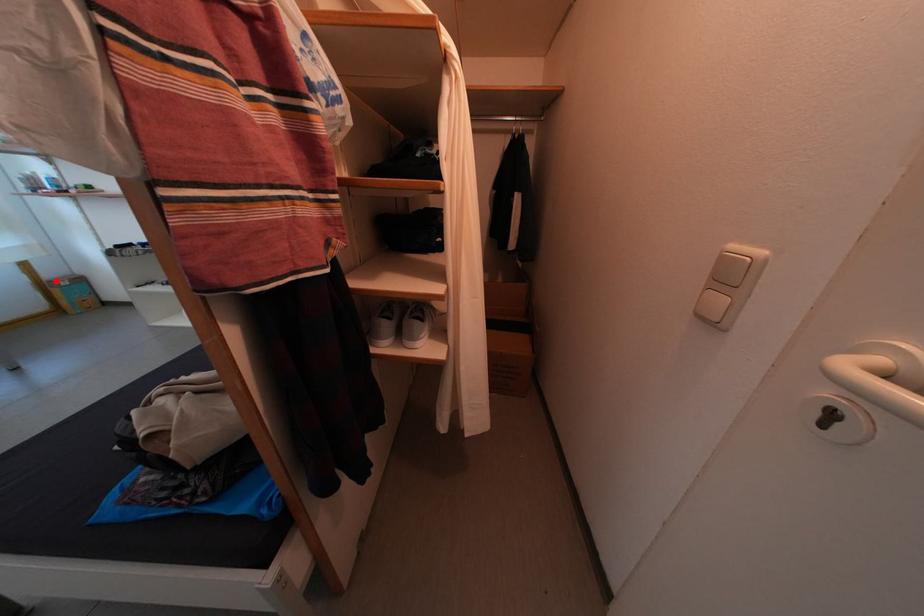
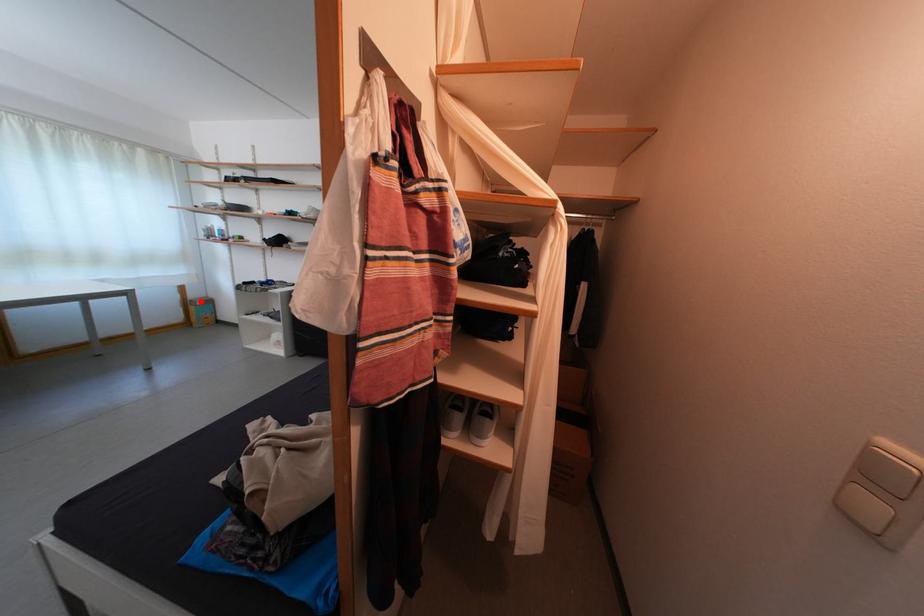
I am providing you with two images of the same scene from different viewpoints. A red point is marked on the first image and another point is marked on the second image. Is the red point in image1 aligned with the point shown in image2?

Yes